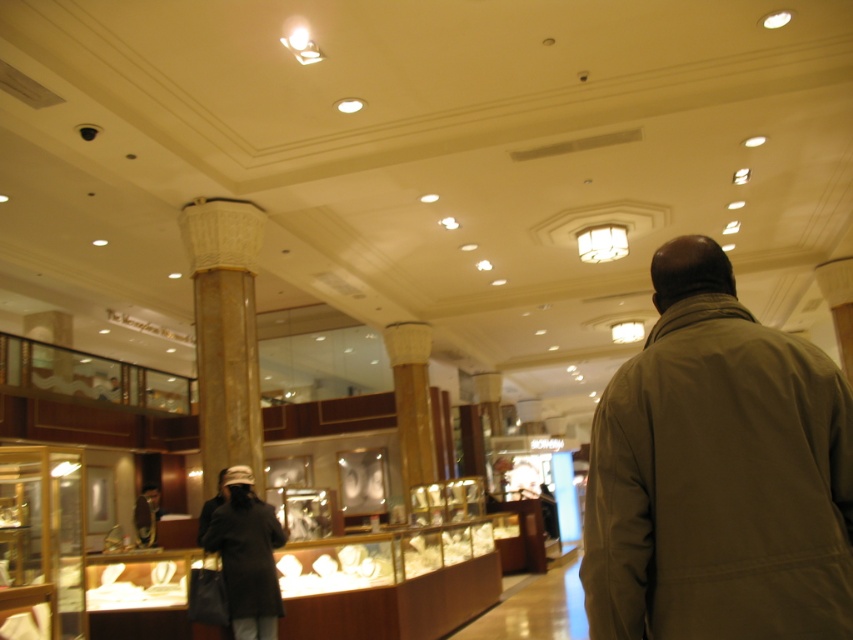
Question: Estimate the real-world distances between objects in this image. Which object is closer to the khaki fabric jacket at center?

Choices:
 (A) dark brown leather jacket at lower left
 (B) matte black jacket at lower left

Answer: (A)

Question: In this image, where is dark brown leather jacket at lower left located relative to matte black jacket at lower left?

Choices:
 (A) below
 (B) above

Answer: (B)

Question: Is the position of khaki fabric jacket at center more distant than that of dark brown leather jacket at lower left?

Choices:
 (A) no
 (B) yes

Answer: (A)

Question: Which is nearer to the dark brown leather jacket at lower left?

Choices:
 (A) khaki fabric jacket at center
 (B) matte black jacket at lower left

Answer: (A)

Question: Which of the following is the closest to the observer?

Choices:
 (A) (265, 554)
 (B) (602, 550)
 (C) (155, 499)

Answer: (B)

Question: Does khaki fabric jacket at center have a smaller size compared to matte black jacket at lower left?

Choices:
 (A) no
 (B) yes

Answer: (B)